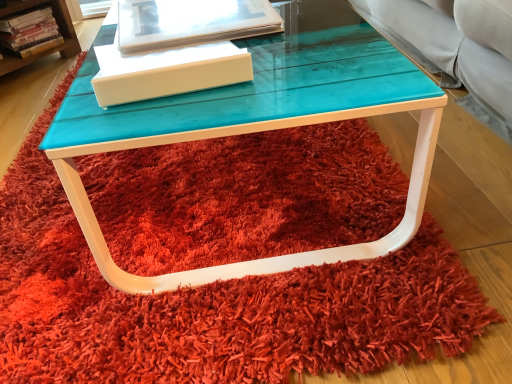
Question: Can you confirm if hardcover book at left, placed as the 1th book when sorted from top to bottom, is thinner than translucent plastic book at upper center, the first book from the bottom?

Choices:
 (A) no
 (B) yes

Answer: (B)

Question: From the image's perspective, is hardcover book at left, which appears as the second book when viewed from the front, above translucent plastic book at upper center, placed as the first book when sorted from front to back?

Choices:
 (A) yes
 (B) no

Answer: (A)

Question: Could translucent plastic book at upper center, placed as the first book when sorted from front to back, be considered to be inside hardcover book at left, which appears as the second book when viewed from the front?

Choices:
 (A) no
 (B) yes

Answer: (A)

Question: Is there a large distance between hardcover book at left, positioned as the first book in back-to-front order, and translucent plastic book at upper center, the first book from the bottom?

Choices:
 (A) no
 (B) yes

Answer: (B)

Question: Is hardcover book at left, positioned as the first book in back-to-front order, further to camera compared to translucent plastic book at upper center, which appears as the 2th book when viewed from the left?

Choices:
 (A) yes
 (B) no

Answer: (A)

Question: Can you confirm if hardcover book at left, positioned as the first book in back-to-front order, is shorter than translucent plastic book at upper center, which appears as the 2th book when viewed from the left?

Choices:
 (A) yes
 (B) no

Answer: (B)

Question: Is white matte box at center positioned in front of turquoise glossy table at center?

Choices:
 (A) no
 (B) yes

Answer: (A)

Question: Is white matte box at center facing away from turquoise glossy table at center?

Choices:
 (A) yes
 (B) no

Answer: (B)

Question: Can you confirm if white matte box at center is positioned to the left of turquoise glossy table at center?

Choices:
 (A) no
 (B) yes

Answer: (B)

Question: From the image's perspective, is white matte box at center on top of turquoise glossy table at center?

Choices:
 (A) no
 (B) yes

Answer: (A)

Question: Considering the relative sizes of white matte box at center and turquoise glossy table at center in the image provided, is white matte box at center shorter than turquoise glossy table at center?

Choices:
 (A) no
 (B) yes

Answer: (B)

Question: Is white matte box at center wider than turquoise glossy table at center?

Choices:
 (A) no
 (B) yes

Answer: (A)

Question: Would you say translucent plastic book at upper center, placed as the first book when sorted from front to back, contains turquoise glossy table at center?

Choices:
 (A) no
 (B) yes

Answer: (A)